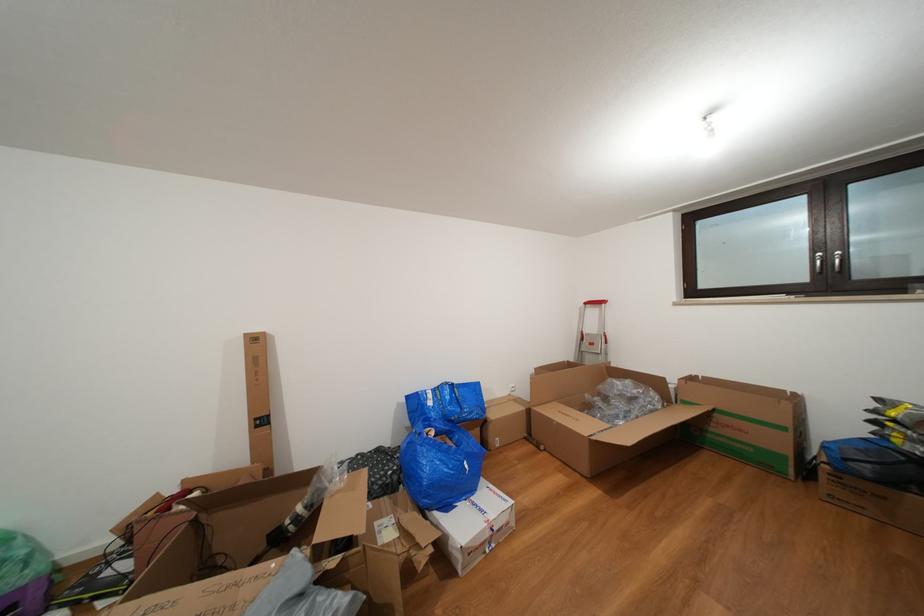
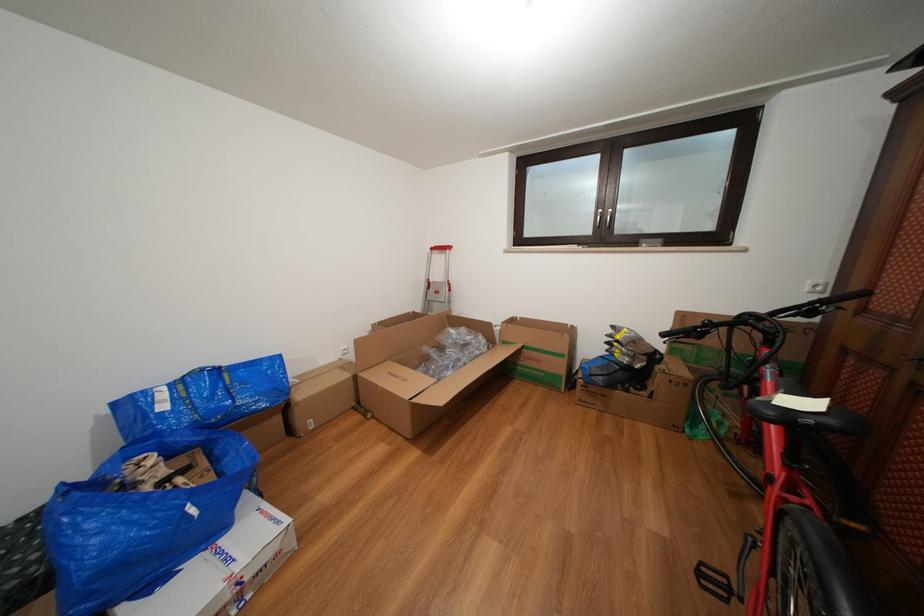
Find the pixel in the second image that matches point (594, 309) in the first image.

(441, 254)